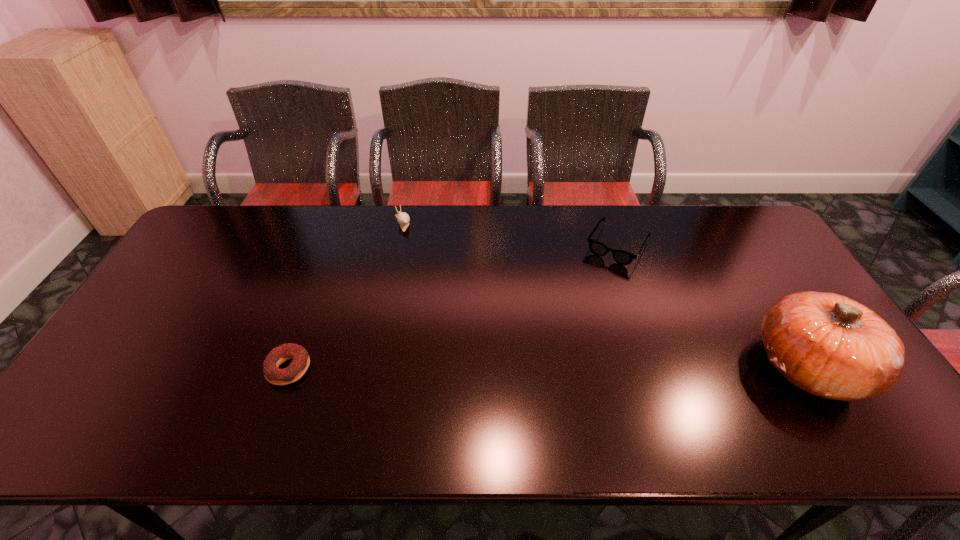
Image resolution: width=960 pixels, height=540 pixels. I want to click on vacant spot on the desktop that is between the doughnut and the rightmost object and is positioned on the shell of the third object from right to left, so click(x=474, y=367).

Image resolution: width=960 pixels, height=540 pixels. I want to click on vacant space on the desktop that is between the doughnut and the pumpkin and is positioned on the arms of the spectacles, so click(544, 367).